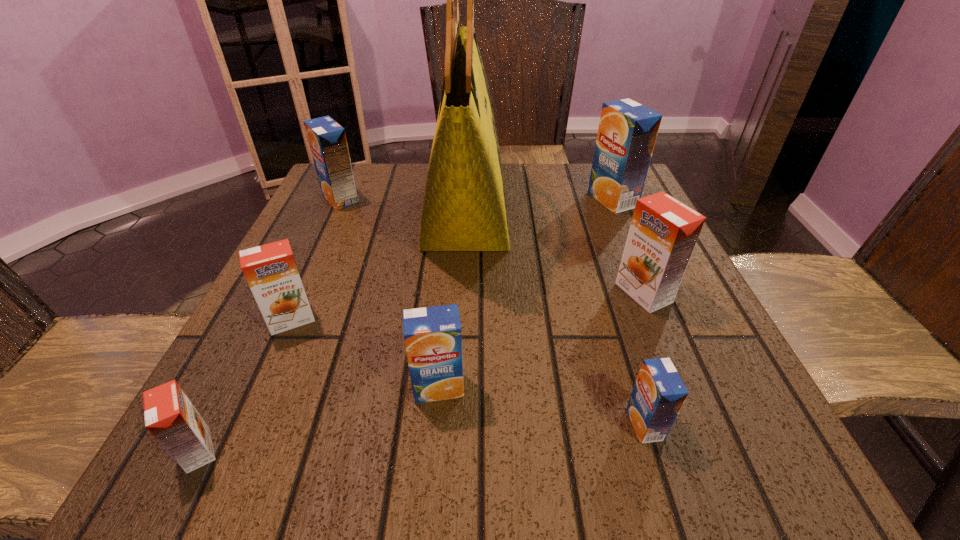
The image size is (960, 540). What are the coordinates of `tote bag` in the screenshot? It's located at (464, 208).

Locate an element on the screen. the tallest object is located at coordinates (464, 208).

Where is `the biggest blue orange_juice`? Image resolution: width=960 pixels, height=540 pixels. the biggest blue orange_juice is located at coordinates point(627,132).

Identify the location of the rightmost blue orange_juice. (627, 132).

The width and height of the screenshot is (960, 540). I want to click on the leftmost blue orange_juice, so click(327, 139).

At what (x,y) coordinates should I click in order to perform the action: click on the biggest orange orange juice. Please return your answer as a coordinate pair (x, y). This screenshot has width=960, height=540. Looking at the image, I should click on (663, 233).

The height and width of the screenshot is (540, 960). What are the coordinates of `the second smallest orange orange juice` in the screenshot? It's located at (271, 271).

This screenshot has height=540, width=960. I want to click on the sixth farthest object, so click(433, 340).

Where is `the fifth farthest orange juice`? The width and height of the screenshot is (960, 540). the fifth farthest orange juice is located at coordinates (433, 340).

Where is `the sixth object from left to right`? The width and height of the screenshot is (960, 540). the sixth object from left to right is located at coordinates (659, 393).